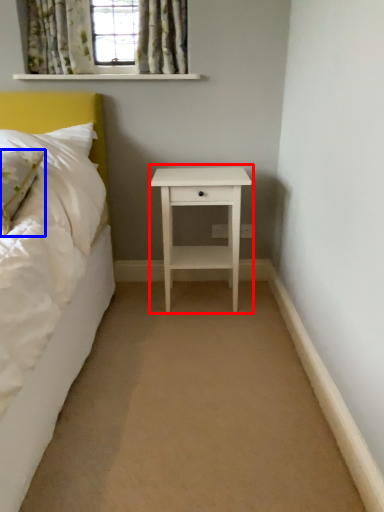
Question: Among these objects, which one is farthest to the camera, nightstand (highlighted by a red box) or pillow (highlighted by a blue box)?

Choices:
 (A) nightstand
 (B) pillow

Answer: (A)